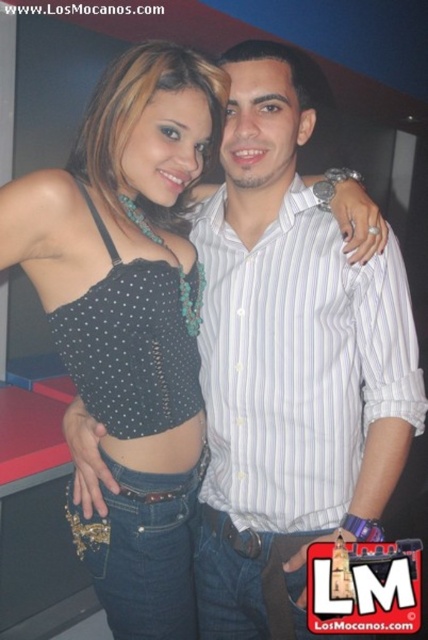
Which of these two, black matte tank top at center or white striped shirt at center, stands taller?

With more height is black matte tank top at center.

Does black matte tank top at center appear under white striped shirt at center?

Correct, black matte tank top at center is located below white striped shirt at center.

The image size is (428, 640). What are the coordinates of `black matte tank top at center` in the screenshot? It's located at (130, 317).